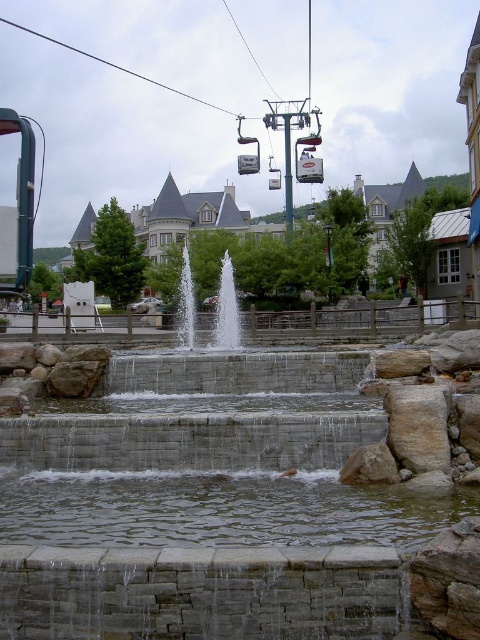
Question: Is clear water at center closer to camera compared to white stone waterfall at center?

Choices:
 (A) no
 (B) yes

Answer: (B)

Question: Is clear water at center thinner than white stone waterfall at center?

Choices:
 (A) yes
 (B) no

Answer: (B)

Question: Which of these objects is positioned closest to the metallic cable car at center?

Choices:
 (A) clear water at center
 (B) white stone waterfall at center

Answer: (B)

Question: Which object appears farthest from the camera in this image?

Choices:
 (A) clear glass waterfall at center
 (B) clear water at center

Answer: (A)

Question: In this image, where is clear water at center located relative to white stone waterfall at center?

Choices:
 (A) below
 (B) above

Answer: (A)

Question: Which of the following is the farthest from the observer?

Choices:
 (A) (440, 528)
 (B) (186, 241)
 (C) (224, 266)
 (D) (155, 300)

Answer: (B)